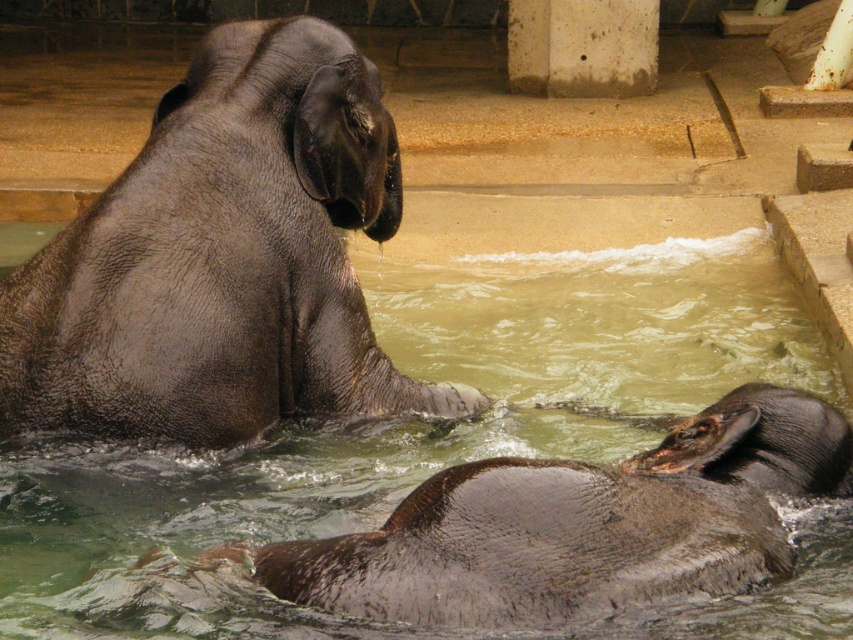
Question: From the image, what is the correct spatial relationship of clear water at elephant center in relation to shiny brown elephant at lower center?

Choices:
 (A) above
 (B) below

Answer: (A)

Question: Which object appears closest to the camera in this image?

Choices:
 (A) clear water at elephant center
 (B) shiny brown elephant at lower center

Answer: (B)

Question: Which of the following is the farthest from the observer?

Choices:
 (A) clear water at elephant center
 (B) gray matte elephant at upper left
 (C) shiny brown elephant at lower center

Answer: (A)

Question: Considering the real-world distances, which object is farthest from the gray matte elephant at upper left?

Choices:
 (A) shiny brown elephant at lower center
 (B) clear water at elephant center

Answer: (B)

Question: Where is clear water at elephant center located in relation to shiny brown elephant at lower center in the image?

Choices:
 (A) left
 (B) right

Answer: (B)

Question: Can you confirm if clear water at elephant center is positioned to the left of shiny brown elephant at lower center?

Choices:
 (A) yes
 (B) no

Answer: (B)